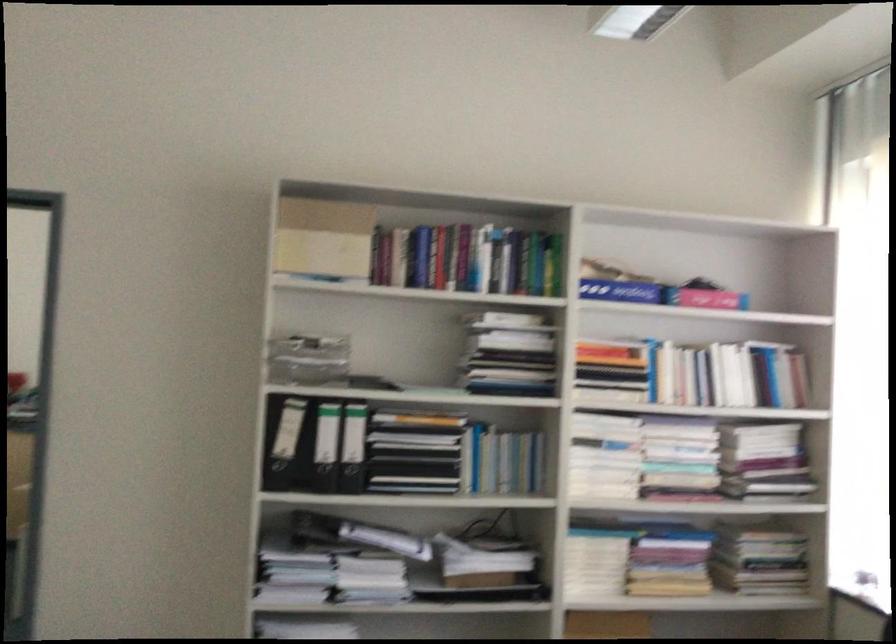
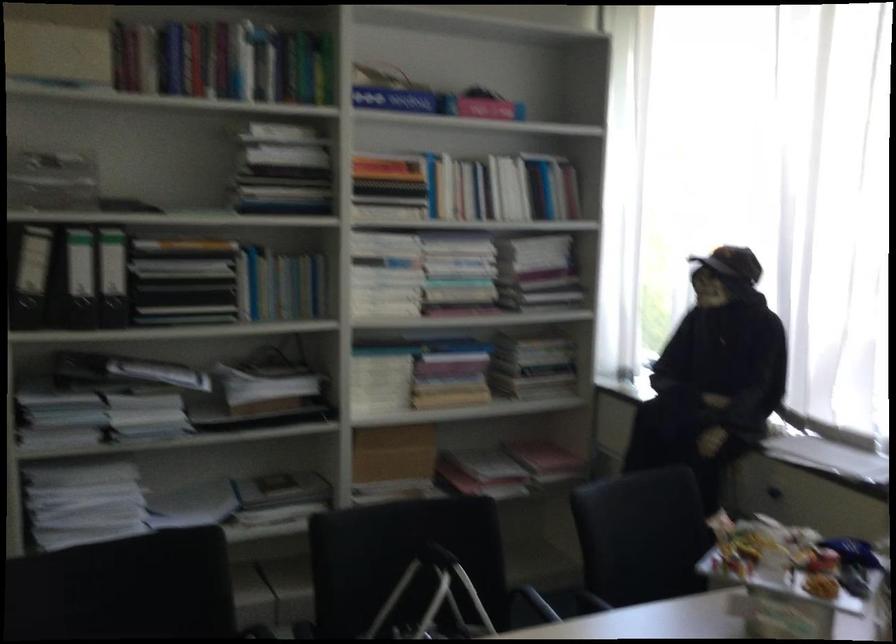
Find the pixel in the second image that matches (x=622, y=283) in the first image.

(393, 99)